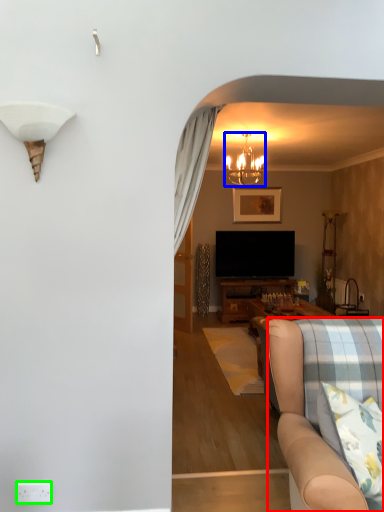
Question: Considering the real-world distances, which object is closest to studio couch (highlighted by a red box)? lamp (highlighted by a blue box) or power outlet (highlighted by a green box).

Choices:
 (A) lamp
 (B) power outlet

Answer: (B)